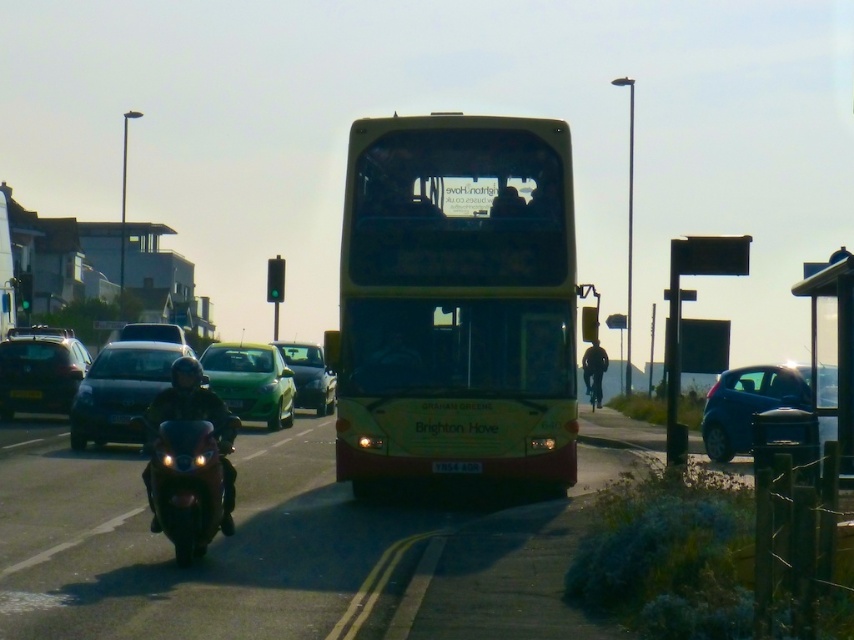
Describe the element at coordinates (250, 381) in the screenshot. The height and width of the screenshot is (640, 854). I see `green matte car at center` at that location.

Between point (287, 417) and point (711, 237), which one is positioned behind?

Point (287, 417)

Is point (291, 372) less distant than point (736, 257)?

No, it is behind (736, 257).

Identify the location of green matte car at center. This screenshot has width=854, height=640. (250, 381).

Who is lower down, metallic blue hatchback at right or white plastic license plate at center?

Positioned lower is white plastic license plate at center.

Between point (705, 440) and point (9, 392), which one is positioned in front?

Point (705, 440) is in front.

Is point (767, 369) closer to camera compared to point (21, 388)?

Yes, point (767, 369) is in front of point (21, 388).

Where is `metallic blue hatchback at right`? The height and width of the screenshot is (640, 854). metallic blue hatchback at right is located at coordinates (749, 404).

Locate an element on the screen. Image resolution: width=854 pixels, height=640 pixels. matte black car at left is located at coordinates (39, 371).

Is matte black car at left bigger than yellow matte license plate at center?

Correct, matte black car at left is larger in size than yellow matte license plate at center.

Image resolution: width=854 pixels, height=640 pixels. I want to click on matte black car at left, so click(39, 371).